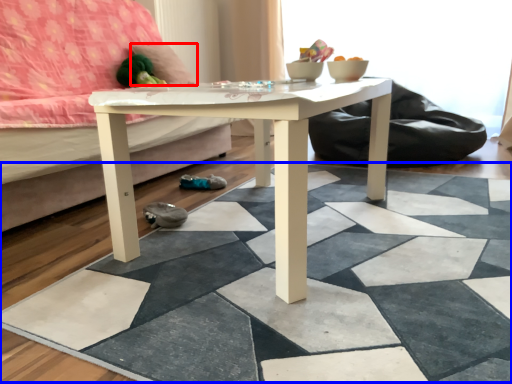
Question: Which object appears farthest to the camera in this image, pillow (highlighted by a red box) or tile (highlighted by a blue box)?

Choices:
 (A) pillow
 (B) tile

Answer: (A)